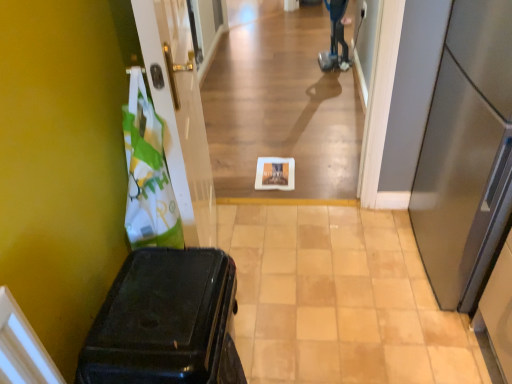
Find the location of `free space in front of blue plastic mobility scooter at upper center`. free space in front of blue plastic mobility scooter at upper center is located at coordinates (336, 74).